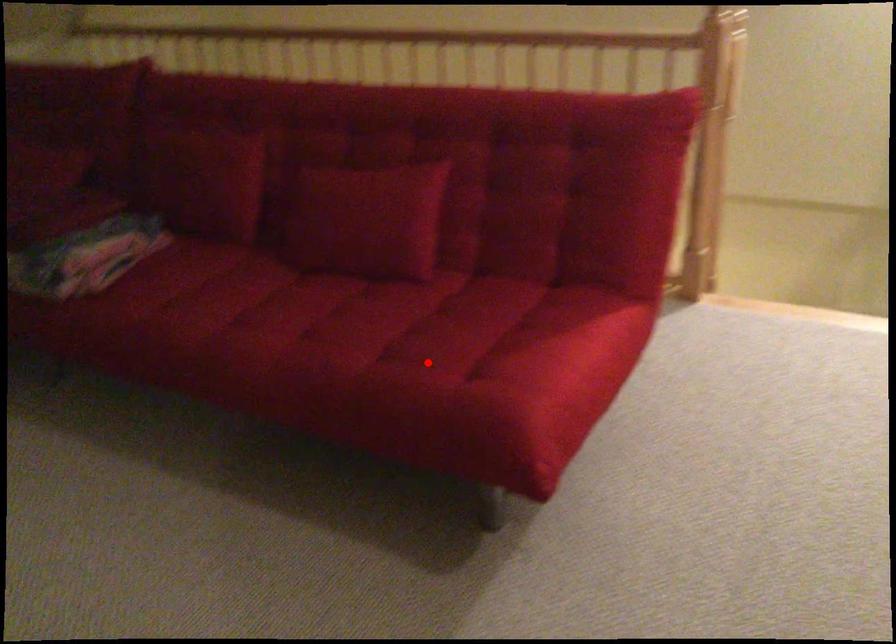
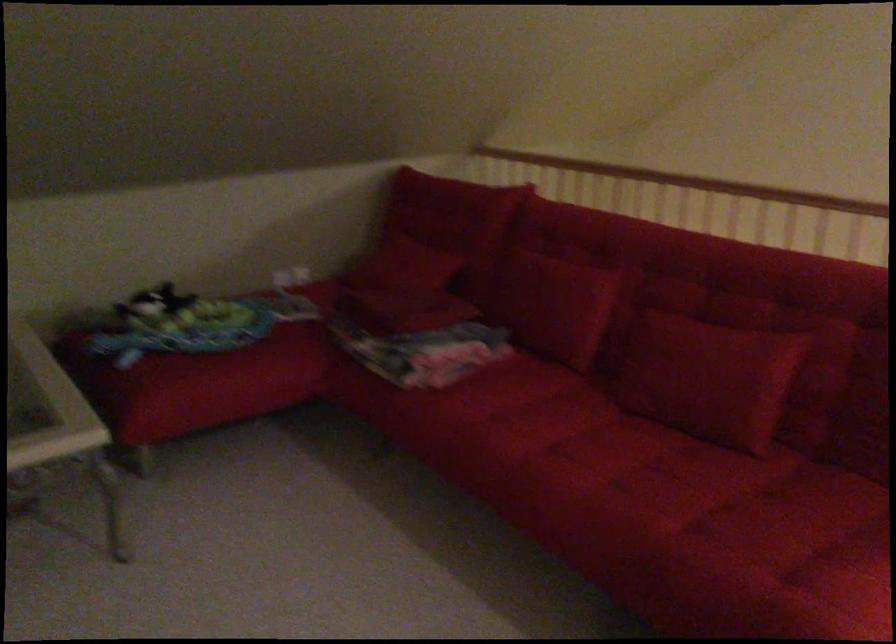
Question: I am providing you with two images of the same scene from different viewpoints. A red point is shown in image1. For the corresponding object point in image2, is it positioned nearer or farther from the camera?

Choices:
 (A) Nearer
 (B) Farther

Answer: (A)